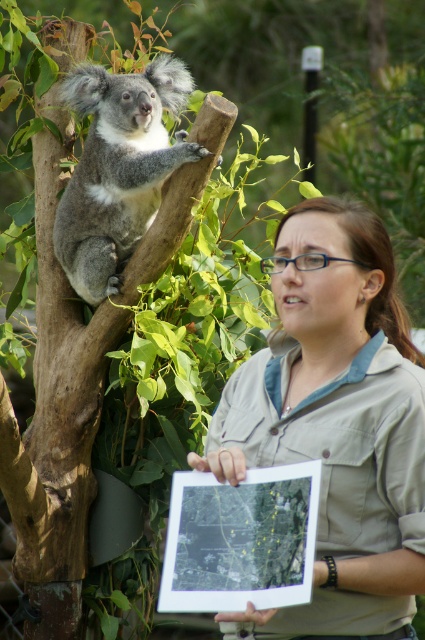
Question: Which object is closer to the camera taking this photo?

Choices:
 (A) matte khaki shirt at center
 (B) gray furry koala at upper left

Answer: (A)

Question: Is matte khaki shirt at center behind black paper map at upper center?

Choices:
 (A) no
 (B) yes

Answer: (B)

Question: Which point is closer to the camera?

Choices:
 (A) (181, 582)
 (B) (163, 140)

Answer: (A)

Question: Does matte khaki shirt at center have a greater width compared to black paper map at upper center?

Choices:
 (A) no
 (B) yes

Answer: (B)

Question: Can you confirm if gray furry koala at upper left is wider than black paper map at upper center?

Choices:
 (A) no
 (B) yes

Answer: (B)

Question: Based on their relative distances, which object is farther from the black paper map at upper center?

Choices:
 (A) matte khaki shirt at center
 (B) gray furry koala at upper left

Answer: (B)